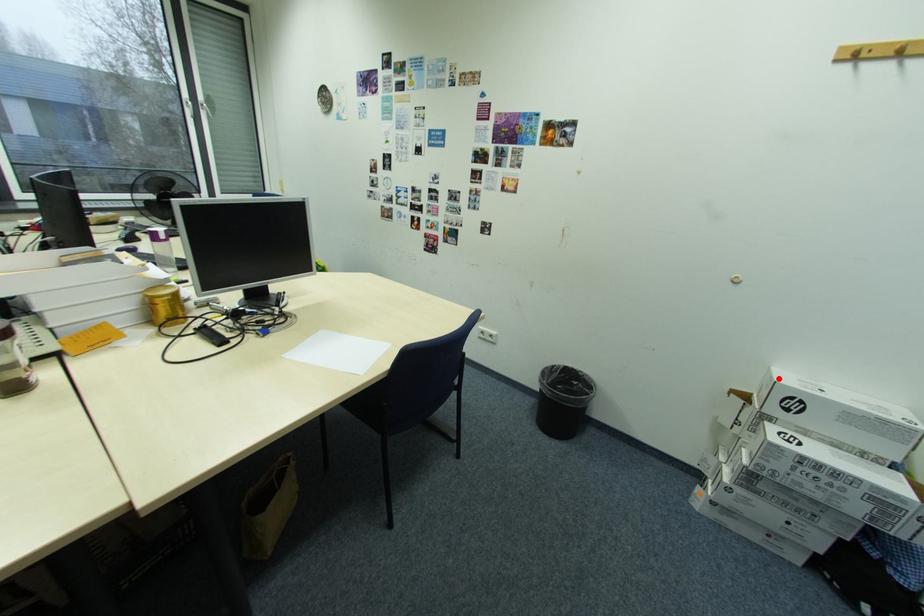
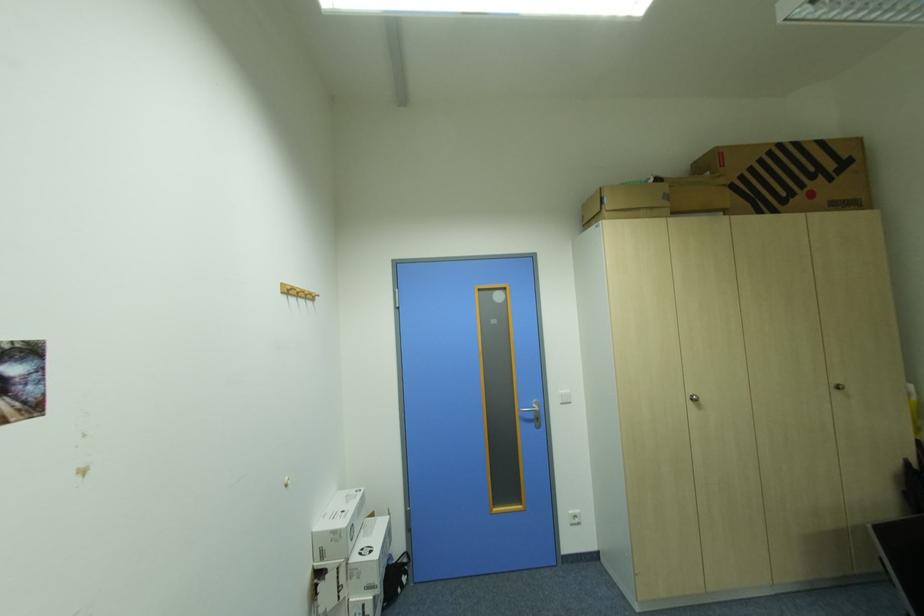
Where in the second image is the point corresponding to the highlighted location from the first image?

(341, 533)